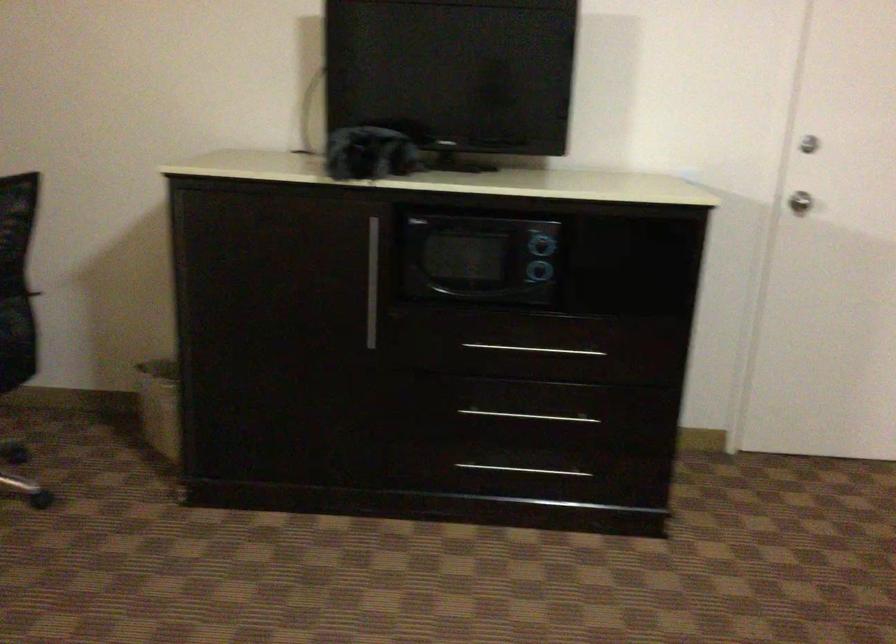
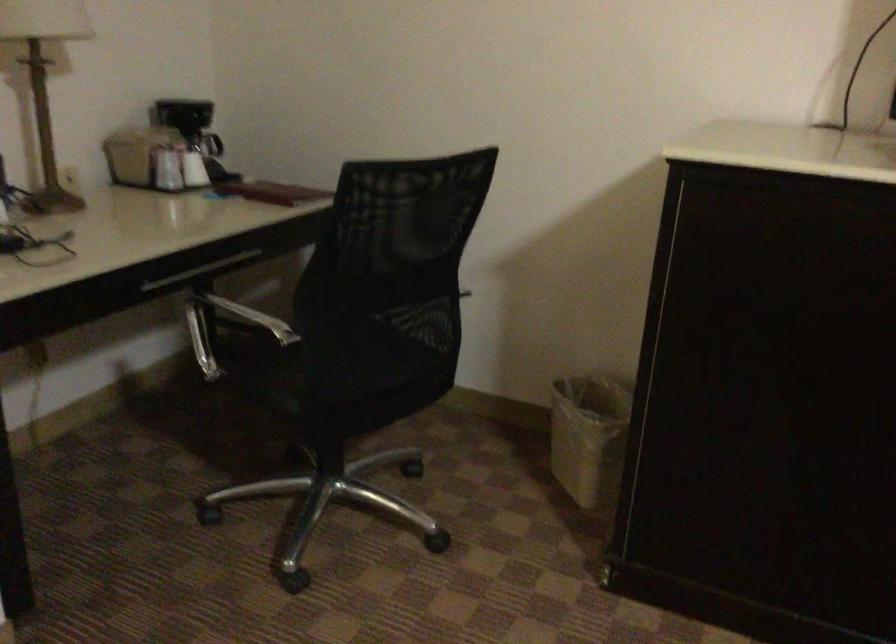
Locate, in the second image, the point that corresponds to point (161, 397) in the first image.

(589, 437)